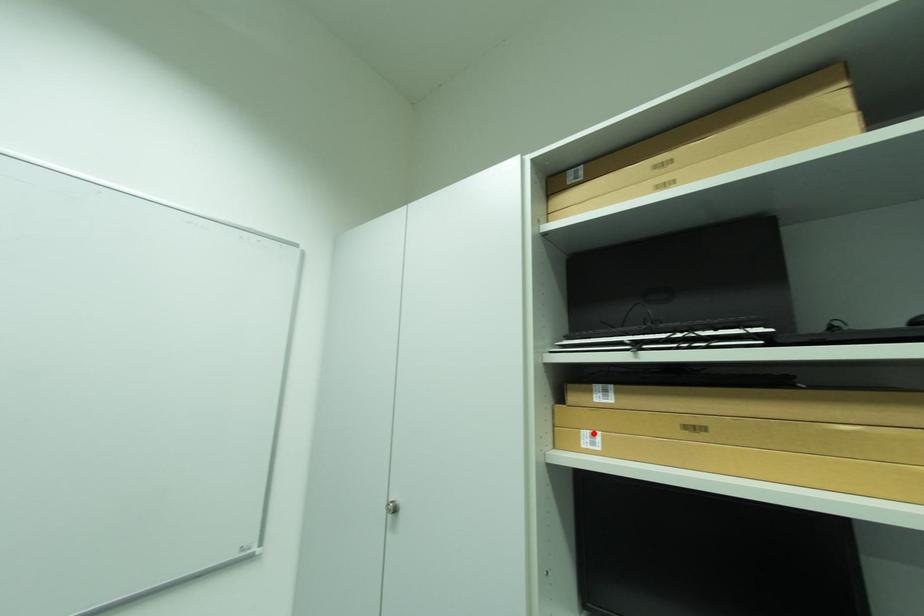
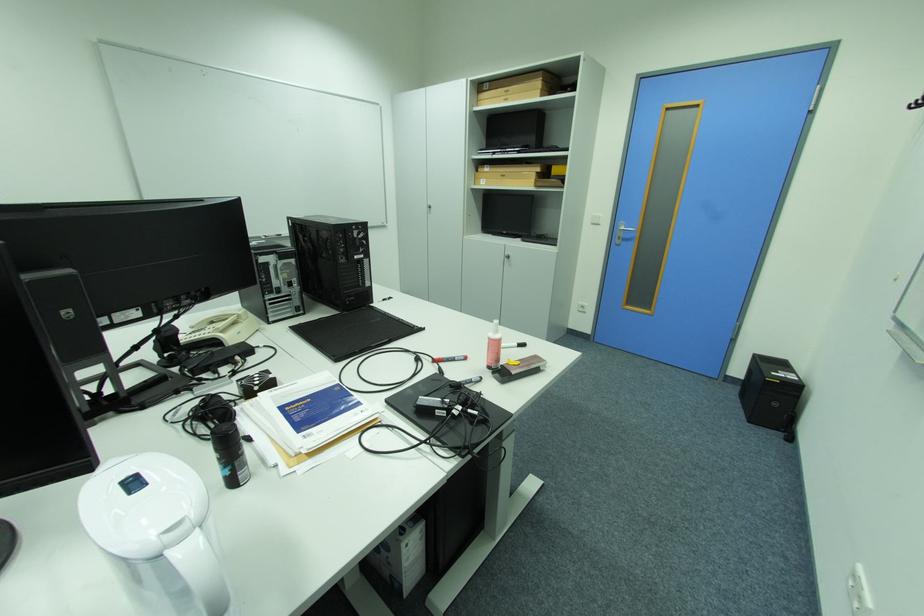
Question: I am providing you with two images of the same scene from different viewpoints. A red point is shown in image1. For the corresponding object point in image2, is it positioned nearer or farther from the camera?

Choices:
 (A) Nearer
 (B) Farther

Answer: (A)